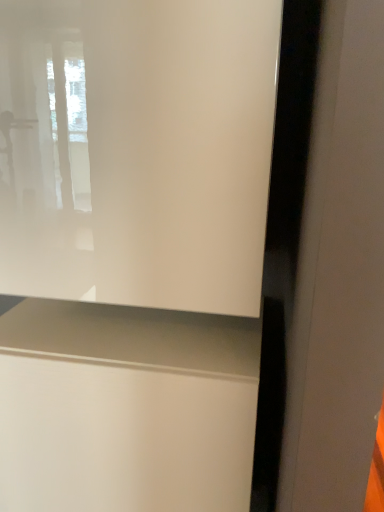
Question: From a real-world perspective, is matte white vanity at lower center below transparent glass window at upper left?

Choices:
 (A) yes
 (B) no

Answer: (A)

Question: Is matte white vanity at lower center closer to the viewer compared to transparent glass window at upper left?

Choices:
 (A) yes
 (B) no

Answer: (B)

Question: From the image's perspective, is matte white vanity at lower center located beneath transparent glass window at upper left?

Choices:
 (A) yes
 (B) no

Answer: (A)

Question: Considering the relative sizes of matte white vanity at lower center and transparent glass window at upper left in the image provided, is matte white vanity at lower center smaller than transparent glass window at upper left?

Choices:
 (A) yes
 (B) no

Answer: (B)

Question: Is matte white vanity at lower center further to the viewer compared to transparent glass window at upper left?

Choices:
 (A) no
 (B) yes

Answer: (B)

Question: Is matte white vanity at lower center outside transparent glass window at upper left?

Choices:
 (A) yes
 (B) no

Answer: (A)

Question: Can you confirm if transparent glass window at upper left is shorter than matte white vanity at lower center?

Choices:
 (A) no
 (B) yes

Answer: (B)

Question: Can you confirm if transparent glass window at upper left is bigger than matte white vanity at lower center?

Choices:
 (A) no
 (B) yes

Answer: (A)

Question: Considering the relative sizes of transparent glass window at upper left and matte white vanity at lower center in the image provided, is transparent glass window at upper left taller than matte white vanity at lower center?

Choices:
 (A) yes
 (B) no

Answer: (B)

Question: Is transparent glass window at upper left outside matte white vanity at lower center?

Choices:
 (A) yes
 (B) no

Answer: (A)

Question: Is matte white vanity at lower center located within transparent glass window at upper left?

Choices:
 (A) no
 (B) yes

Answer: (A)

Question: Does transparent glass window at upper left turn towards matte white vanity at lower center?

Choices:
 (A) yes
 (B) no

Answer: (B)

Question: Is matte white vanity at lower center taller or shorter than transparent glass window at upper left?

Choices:
 (A) tall
 (B) short

Answer: (A)